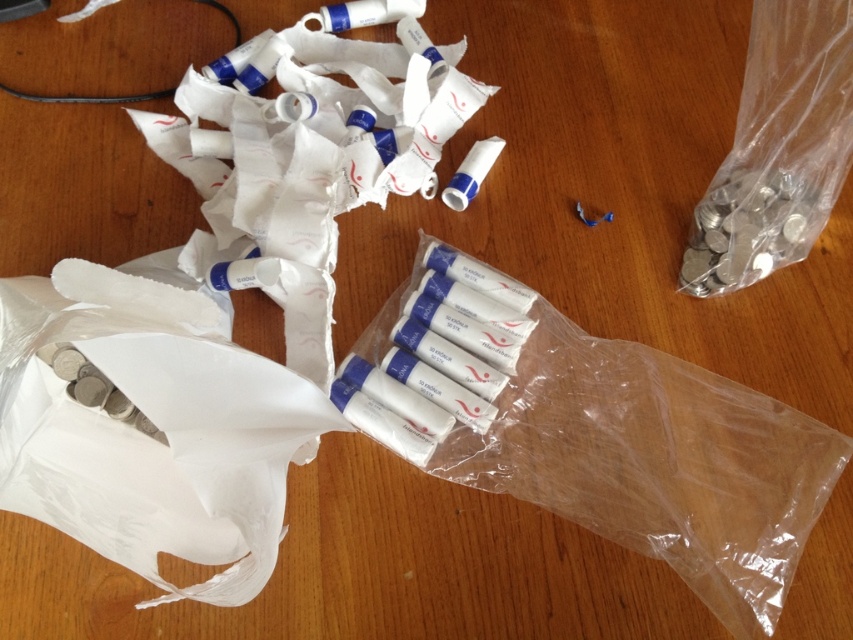
Please provide the coordinates of the clear plastic bag at center.

The clear plastic bag at center is located at coordinates point [593,432].

You are a delivery robot with a 1.2 meters arm. You need to pick up the clear plastic bag at center from the table. Can your arm reach it?

The clear plastic bag at center is 1.21 meters away from the camera. Since your arm is 1.2 meters, it is just slightly shorter, so you cannot reach it.

You are organizing items on a table. You have a clear plastic bag at center and a white paper bag at lower left. Which bag is taller?

The clear plastic bag at center is taller than the white paper bag at lower left according to the description.